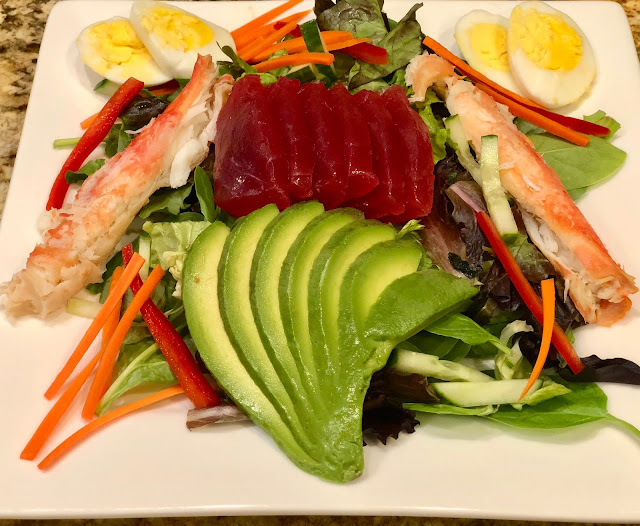
You are a GUI agent. You are given a task and a screenshot of the screen. Output one action in this format:
    pyautogui.click(x=<x>, y=<y>)
    Task: Click on the dinner plate
    Image resolution: width=640 pixels, height=526 pixels.
    Given the screenshot: What is the action you would take?
    pyautogui.click(x=171, y=471)